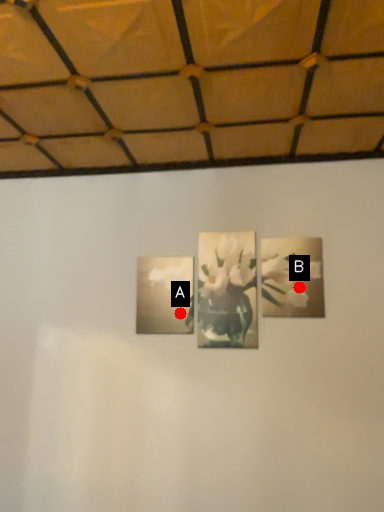
Question: Two points are circled on the image, labeled by A and B beside each circle. Among these points, which one is nearest to the camera?

Choices:
 (A) A is closer
 (B) B is closer

Answer: (B)